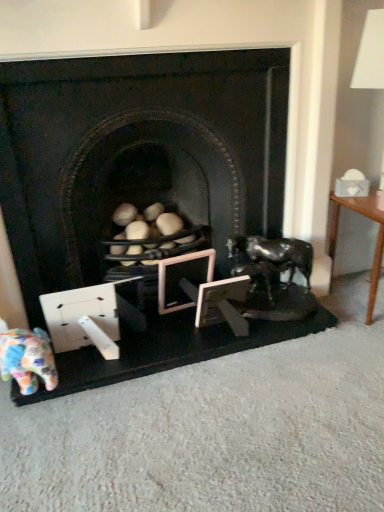
Question: Does matte black fireplace at center have a smaller size compared to wooden picture frame at center, acting as the 2th picture frame starting from the left?

Choices:
 (A) yes
 (B) no

Answer: (B)

Question: Is matte black fireplace at center beside wooden picture frame at center, acting as the 2th picture frame starting from the left?

Choices:
 (A) no
 (B) yes

Answer: (A)

Question: Does matte black fireplace at center have a lesser height compared to wooden picture frame at center, arranged as the first picture frame when viewed from the right?

Choices:
 (A) no
 (B) yes

Answer: (A)

Question: Is matte black fireplace at center outside wooden picture frame at center, acting as the 2th picture frame starting from the left?

Choices:
 (A) yes
 (B) no

Answer: (A)

Question: Is matte black fireplace at center facing towards wooden picture frame at center, acting as the 2th picture frame starting from the left?

Choices:
 (A) yes
 (B) no

Answer: (A)

Question: Is wooden picture frame at center, acting as the 2th picture frame starting from the left, a part of matte black fireplace at center?

Choices:
 (A) no
 (B) yes

Answer: (A)

Question: Are matte black fireplace at center and wooden table at right far apart?

Choices:
 (A) yes
 (B) no

Answer: (B)

Question: Can you confirm if matte black fireplace at center is positioned to the right of wooden table at right?

Choices:
 (A) yes
 (B) no

Answer: (B)

Question: Is matte black fireplace at center looking in the opposite direction of wooden table at right?

Choices:
 (A) yes
 (B) no

Answer: (B)

Question: From the image's perspective, is matte black fireplace at center on wooden table at right?

Choices:
 (A) yes
 (B) no

Answer: (A)

Question: Can you confirm if matte black fireplace at center is shorter than wooden table at right?

Choices:
 (A) yes
 (B) no

Answer: (B)

Question: Does matte black fireplace at center have a greater width compared to wooden table at right?

Choices:
 (A) yes
 (B) no

Answer: (A)

Question: Does wooden picture frame at center, the 1th picture frame in the left-to-right sequence, come in front of multicolored fabric elephant at lower left?

Choices:
 (A) no
 (B) yes

Answer: (A)